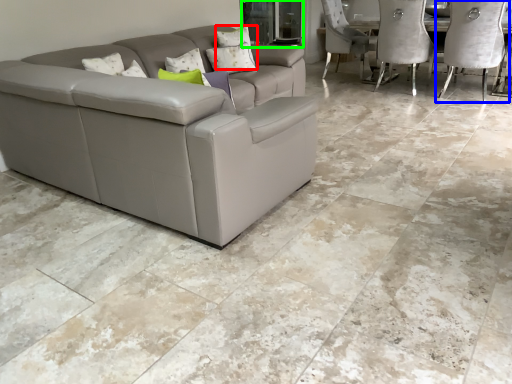
Question: Considering the real-world distances, which object is closest to pillow (highlighted by a red box)? chair (highlighted by a blue box) or glass door (highlighted by a green box).

Choices:
 (A) chair
 (B) glass door

Answer: (B)